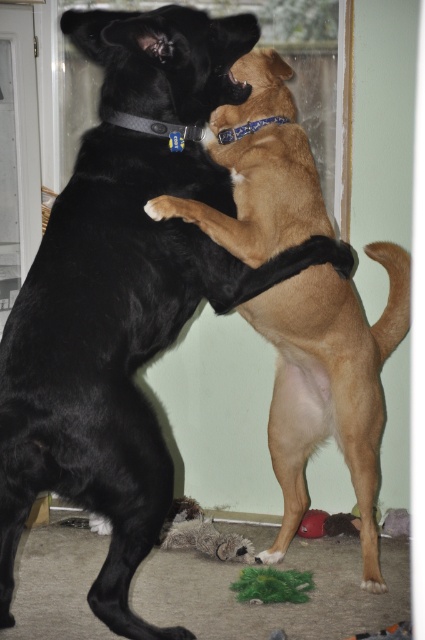
You are a delivery person trying to enter the house through the transparent glass screen door at left. There is a brown furry dog at center blocking your path. Can you walk around the dog to reach the door?

The brown furry dog at center is larger in size than the transparent glass screen door at left, so it might block your path completely. You might need to ask the dog to move aside before proceeding.

You are a delivery person trying to enter the house through the transparent glass screen door at left. There is a brown furry dog at center blocking your path. Can you walk around the dog to reach the door?

The brown furry dog at center is in front of the transparent glass screen door at left, so you can walk around the dog to reach the door since it is blocking the path but not the entire entrance.

Looking at this image, you are trying to fit the brown furry dog at center through the transparent glass screen door at left. Based on their sizes, will the dog fit through the door?

The brown furry dog at center is larger in width than the transparent glass screen door at left, so the dog will not fit through the door.